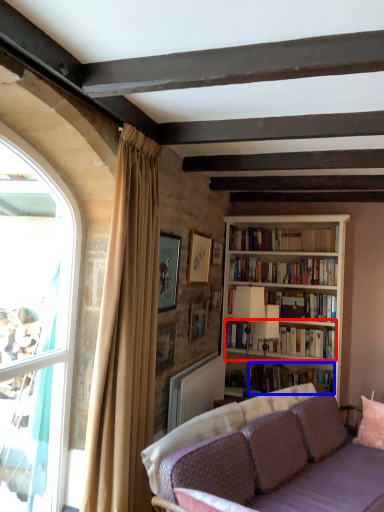
Question: Which point is closer to the camera, book (highlighted by a red box) or book (highlighted by a blue box)?

Choices:
 (A) book
 (B) book

Answer: (B)